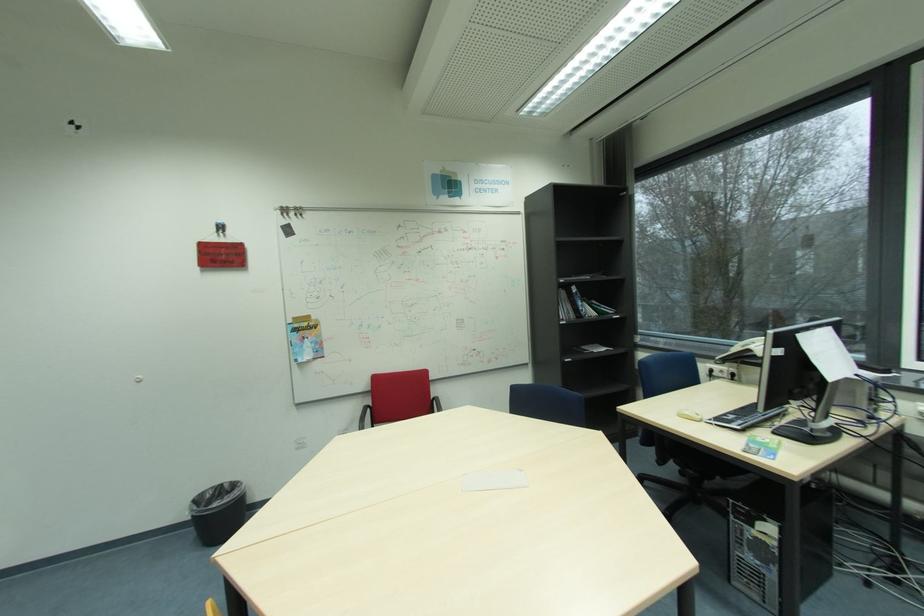
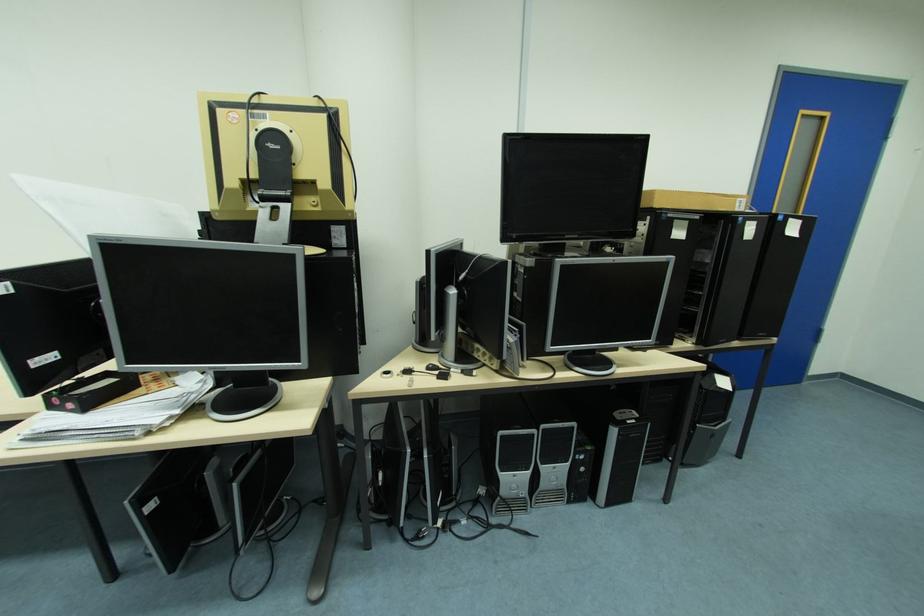
How did the camera likely rotate?

The camera rotated toward left-down.